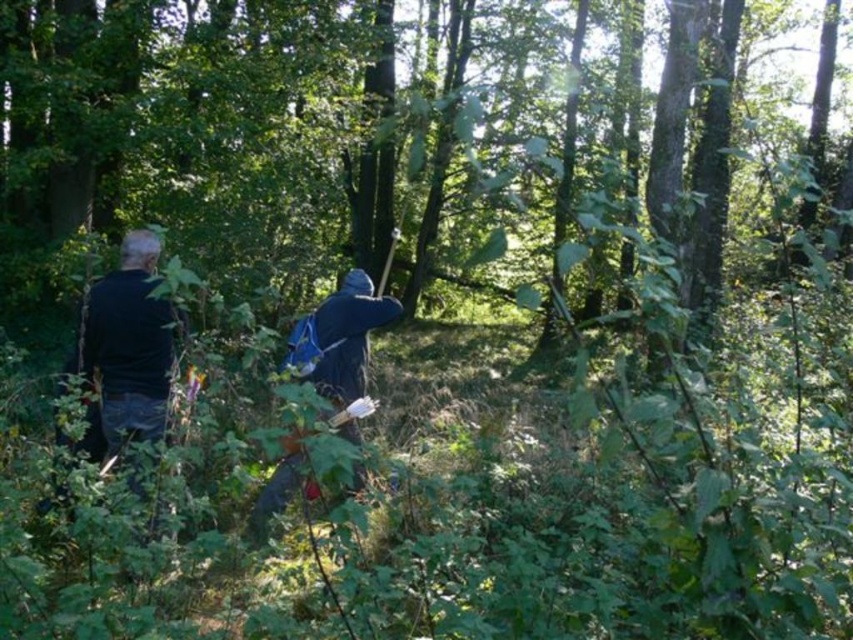
You are standing in the forest and want to reach a specific point marked at coordinates point [100,422]. If you can walk 5 meters in a straight line, will you be able to reach that point?

The distance of point [100,422] from viewer is 4.14 meters, so yes, you can reach it since 4.14 meters is less than 5 meters.

You are a forest guide leading a group through the dense forest. You notice two hikers ahead of you. One is wearing a black matte jacket at left and the other has a dark blue hooded cloak at center. Which hiker is closer to you?

The black matte jacket at left is closer to you because it is in front of the dark blue hooded cloak at center.